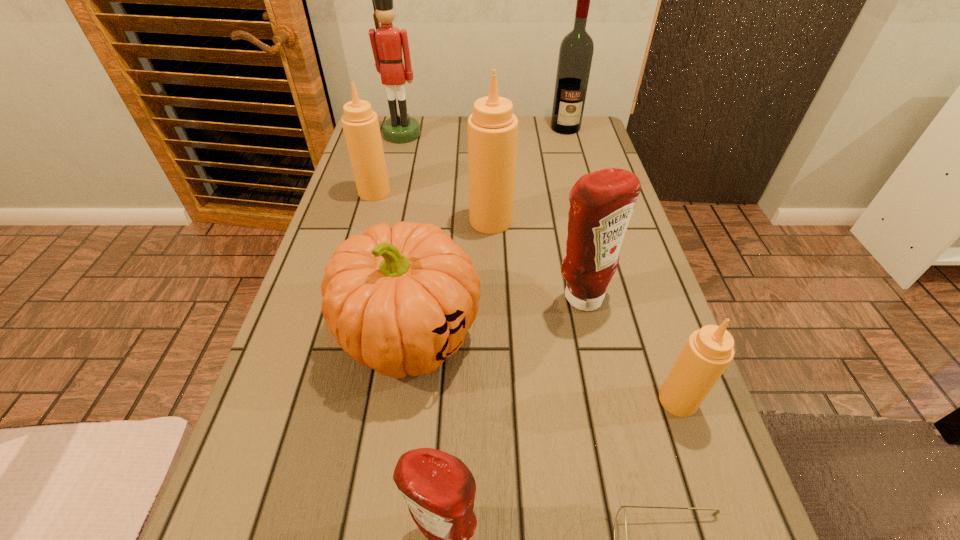
Where is `vacant area between the right red condiment and the smallest tan condiment`? vacant area between the right red condiment and the smallest tan condiment is located at coordinates (630, 349).

This screenshot has height=540, width=960. Identify the location of free spot between the smallest tan condiment and the farthest condiment. (526, 296).

Locate an element on the screen. The height and width of the screenshot is (540, 960). vacant space that's between the second tan condiment from left to right and the green alcohol is located at coordinates click(528, 174).

The width and height of the screenshot is (960, 540). Find the location of `unoccupied area between the rightmost tan condiment and the alcohol`. unoccupied area between the rightmost tan condiment and the alcohol is located at coordinates (x=622, y=264).

This screenshot has height=540, width=960. Identify the location of object that stands as the fifth closest to the farthest condiment. (576, 50).

The height and width of the screenshot is (540, 960). I want to click on object that is the eighth closest to the pumpkin, so click(576, 50).

Image resolution: width=960 pixels, height=540 pixels. I want to click on condiment that is the fourth closest to the pumpkin, so click(360, 123).

At what (x,y) coordinates should I click in order to perform the action: click on condiment that is the third closest to the second nearest condiment. Please return your answer as a coordinate pair (x, y). The width and height of the screenshot is (960, 540). Looking at the image, I should click on (493, 128).

Locate an element on the screen. The width and height of the screenshot is (960, 540). tan condiment that is the second nearest to the sixth nearest object is located at coordinates (708, 351).

The width and height of the screenshot is (960, 540). In order to click on the second closest tan condiment to the smallest tan condiment in this screenshot , I will do `click(360, 123)`.